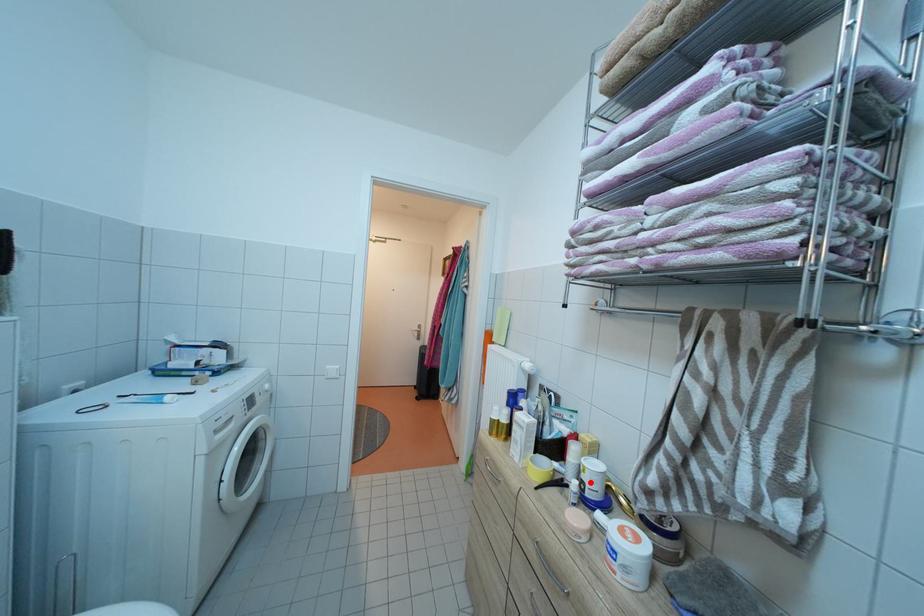
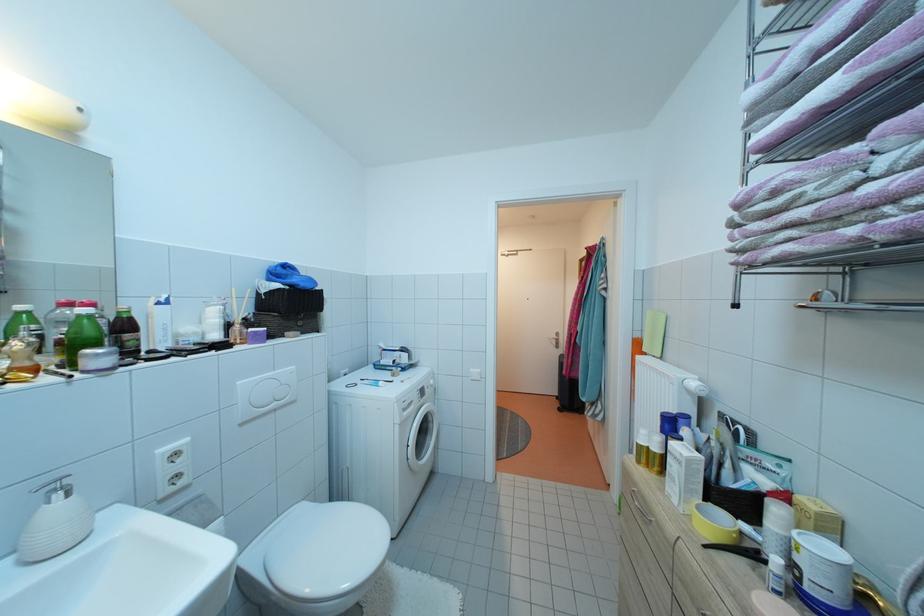
The point at the highlighted location is marked in the first image. Where is the corresponding point in the second image?

(805, 565)